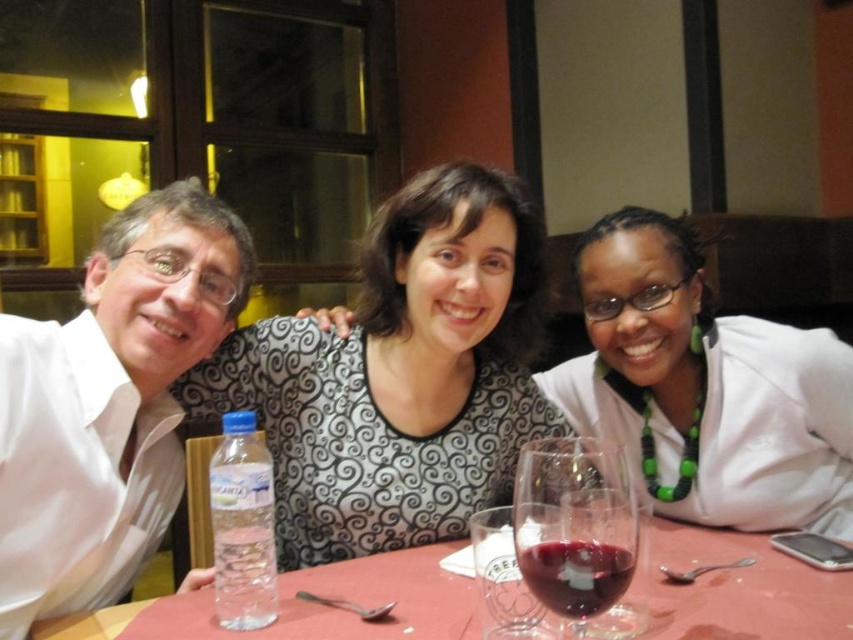
Question: Does green beaded necklace at upper right have a smaller size compared to dark red glass at center?

Choices:
 (A) yes
 (B) no

Answer: (B)

Question: Is white glossy shirt at left thinner than green beaded necklace at upper right?

Choices:
 (A) no
 (B) yes

Answer: (B)

Question: Considering the relative positions of smooth plastic water bottle at lower left and dark red glass at center in the image provided, where is smooth plastic water bottle at lower left located with respect to dark red glass at center?

Choices:
 (A) below
 (B) above

Answer: (A)

Question: Among these points, which one is farthest from the camera?

Choices:
 (A) (332, 529)
 (B) (784, 624)
 (C) (270, 604)

Answer: (A)

Question: Estimate the real-world distances between objects in this image. Which object is farther from the green beaded necklace at upper right?

Choices:
 (A) smooth plastic water bottle at lower left
 (B) white glossy shirt at left
 (C) clear plastic bottle at lower left

Answer: (B)

Question: Which object is the closest to the clear plastic bottle at lower left?

Choices:
 (A) green beaded necklace at upper right
 (B) transparent glass at table center
 (C) white glossy shirt at left

Answer: (C)